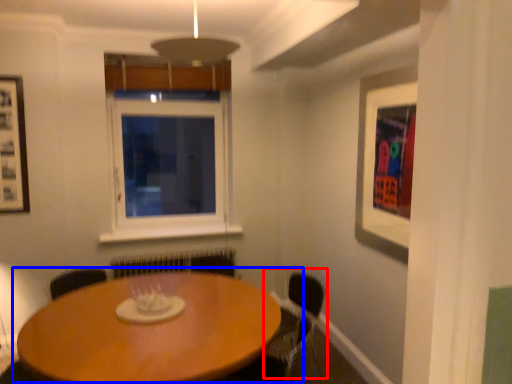
Question: Which of the following is the farthest to the observer, armchair (highlighted by a red box) or table (highlighted by a blue box)?

Choices:
 (A) armchair
 (B) table

Answer: (A)